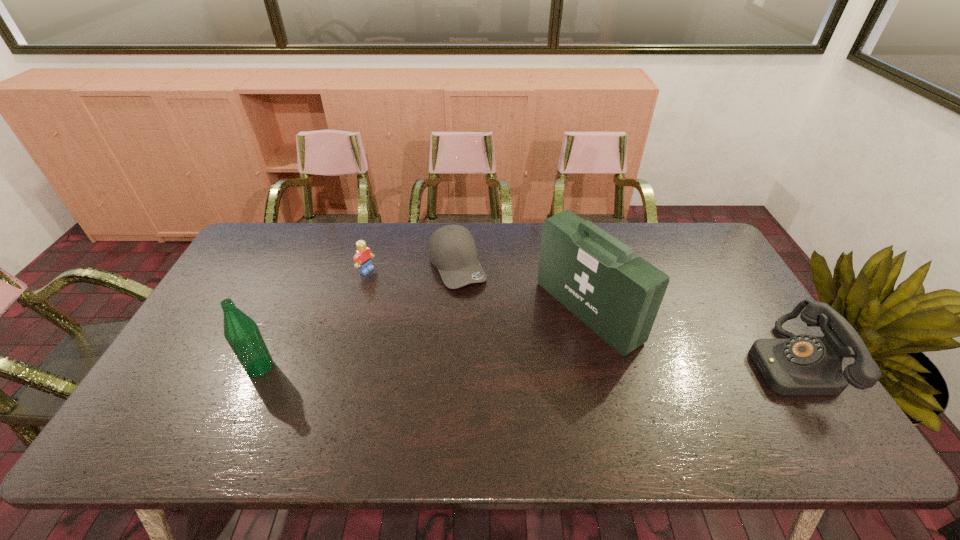
At what (x,y) coordinates should I click in order to perform the action: click on vacant space located 0.270m on the dial of the third shortest object. Please return your answer as a coordinate pair (x, y). The image size is (960, 540). Looking at the image, I should click on (651, 363).

Where is `vacant region located on the front-facing side of the second object from right to left`? Image resolution: width=960 pixels, height=540 pixels. vacant region located on the front-facing side of the second object from right to left is located at coordinates (534, 348).

Find the location of a particular element. This screenshot has width=960, height=540. free location located on the front-facing side of the second object from right to left is located at coordinates (479, 380).

Where is `vacant space situated 0.330m on the front-facing side of the second object from right to left`? vacant space situated 0.330m on the front-facing side of the second object from right to left is located at coordinates (453, 395).

This screenshot has height=540, width=960. I want to click on free spot located on the front brim of the baseball cap, so click(x=499, y=345).

This screenshot has height=540, width=960. In order to click on vacant position located 0.290m on the front brim of the baseball cap in this screenshot , I will do `click(508, 361)`.

Locate an element on the screen. vacant area situated 0.150m on the front brim of the baseball cap is located at coordinates (487, 325).

The height and width of the screenshot is (540, 960). I want to click on blank space located on the front-facing side of the Lego, so click(x=437, y=310).

At what (x,y) coordinates should I click in order to perform the action: click on vacant position located on the front-facing side of the Lego. Please return your answer as a coordinate pair (x, y). Image resolution: width=960 pixels, height=540 pixels. Looking at the image, I should click on (461, 323).

Where is `blank space located on the front-facing side of the Lego`? The image size is (960, 540). blank space located on the front-facing side of the Lego is located at coordinates (455, 321).